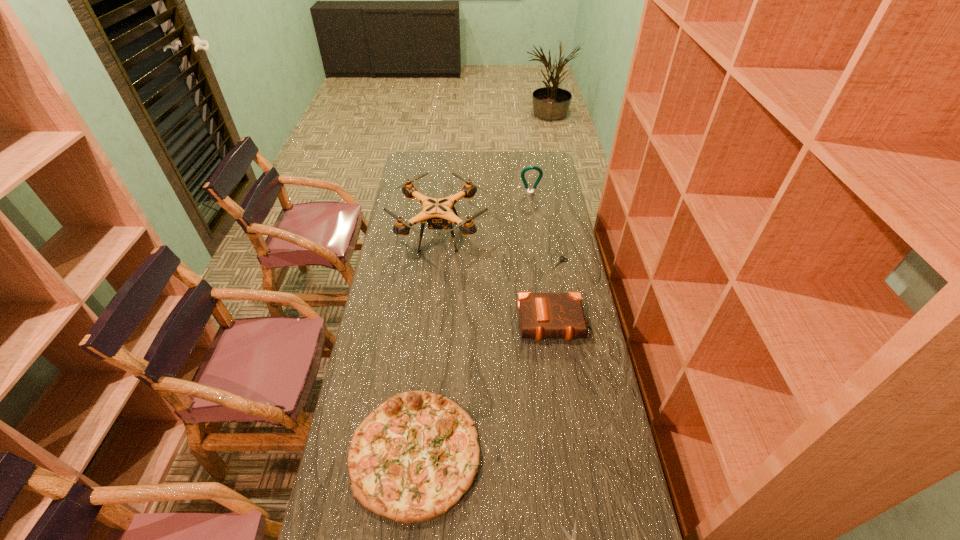
Image resolution: width=960 pixels, height=540 pixels. What are the coordinates of `vacant space located on the back of the pizza` in the screenshot? It's located at (427, 344).

Where is `vacant point located 0.370m on the front of the taller shears`? The image size is (960, 540). vacant point located 0.370m on the front of the taller shears is located at coordinates (575, 346).

Locate an element on the screen. The width and height of the screenshot is (960, 540). drone that is at the left edge is located at coordinates (437, 212).

Locate an element on the screen. pizza that is at the left edge is located at coordinates (411, 459).

In order to click on bottle opener that is at the right edge in this screenshot , I will do `click(538, 169)`.

Locate an element on the screen. Bible located at the right edge is located at coordinates (542, 316).

Where is `shears at the right edge`? shears at the right edge is located at coordinates (561, 260).

This screenshot has width=960, height=540. In the image, there is a desktop. Find the location of `free space at the far edge`. free space at the far edge is located at coordinates (477, 153).

The image size is (960, 540). In order to click on vacant area at the left edge in this screenshot , I will do `click(386, 523)`.

Find the location of a particular element. The width and height of the screenshot is (960, 540). vacant point at the right edge is located at coordinates (569, 246).